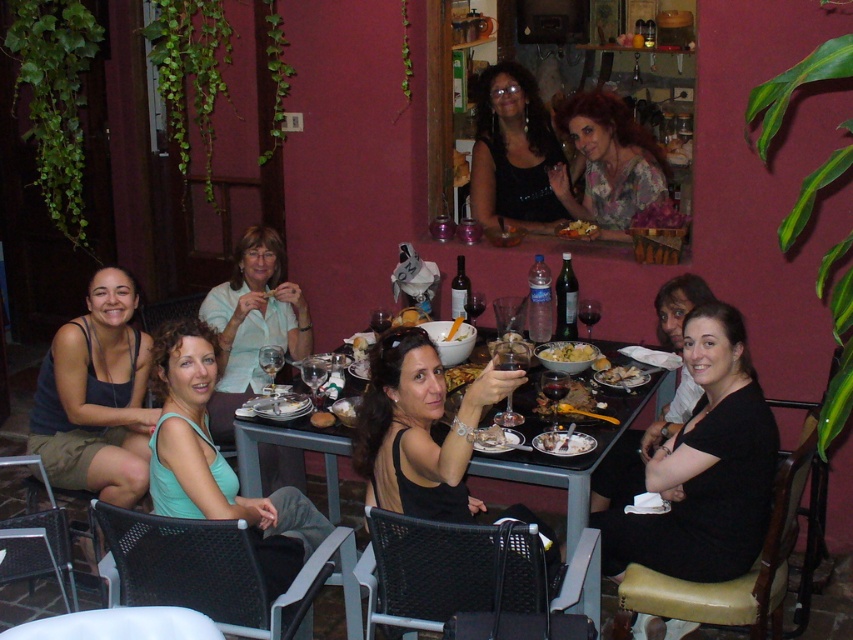
From the picture: You are a photographer trying to capture a candid shot of the dark blue tank top at lower left and the light blue fabric shirt at center. Since you want to ensure both are clearly visible in the frame, which clothing item should you focus on to avoid blurriness due to size differences?

The dark blue tank top at lower left has a larger width than the light blue fabric shirt at center, so focusing on the dark blue tank top at lower left would ensure both are in focus as it is the larger object.

You are at a dinner party and want to pass a dish from the shiny silver bowl at center to the person wearing the green fabric tank top at lower left. Can you reach them directly without moving around the table?

The green fabric tank top at lower left is closer to the viewer than the shiny silver bowl at center, so the person wearing the green fabric tank top at lower left is seated closer to you. Therefore, you can reach them directly by passing the dish across the table since they are closer to you than the bowl.

You are a photographer at the event and want to capture a photo of the shiny silver bowl at center without the black matte dress at center blocking it. How should you position yourself relative to the bowl?

Position yourself to the right side of the shiny silver bowl at center so that the black matte dress at center is to your left, ensuring it doesn not block the bowl.